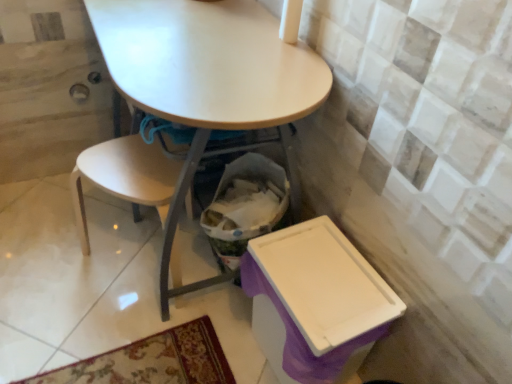
Identify the location of empty space that is ontop of matte white table at center. Image resolution: width=512 pixels, height=384 pixels. (198, 57).